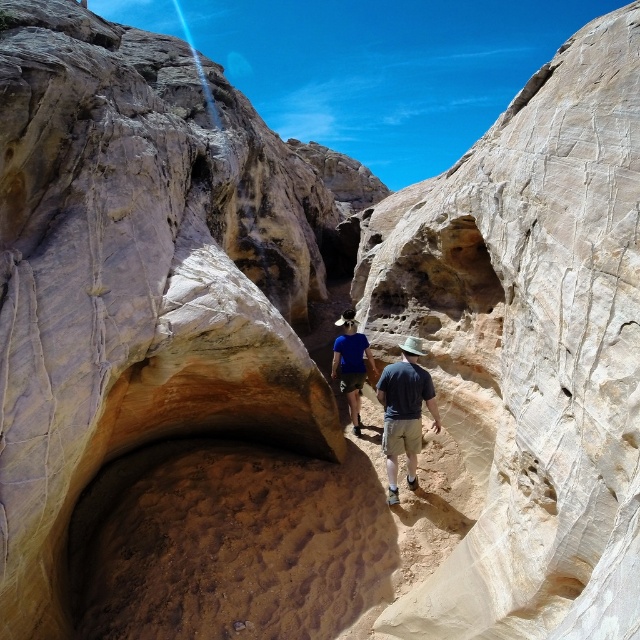
Is dark blue t-shirt at center smaller than blue matte shirt at center?

Yes.

Between dark blue t-shirt at center and blue matte shirt at center, which one is positioned lower?

blue matte shirt at center

At what (x,y) coordinates should I click in order to perform the action: click on dark blue t-shirt at center. Please return your answer as a coordinate pair (x, y). The image size is (640, 640). Looking at the image, I should click on (404, 412).

Find the location of a particular element. The width and height of the screenshot is (640, 640). dark blue t-shirt at center is located at coordinates (404, 412).